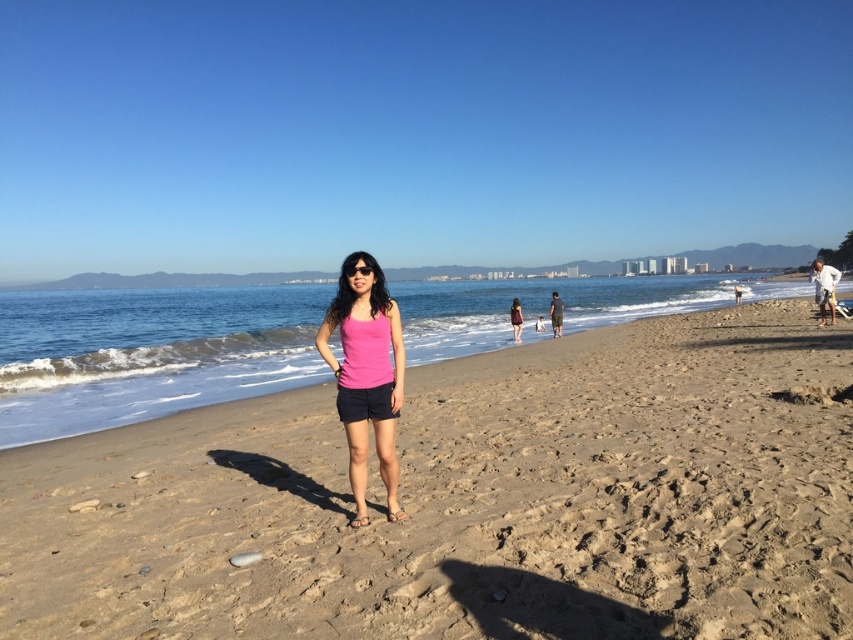
Does light brown sandy beach at center appear on the left side of matte pink tank top at center?

Correct, you'll find light brown sandy beach at center to the left of matte pink tank top at center.

The width and height of the screenshot is (853, 640). Find the location of `light brown sandy beach at center`. light brown sandy beach at center is located at coordinates (469, 500).

This screenshot has height=640, width=853. I want to click on light brown sandy beach at center, so click(469, 500).

Between point (321, 342) and point (509, 314), which one is positioned in front?

Point (321, 342)

Is pink fabric tank top at center below matte pink tank top at center?

Yes, pink fabric tank top at center is below matte pink tank top at center.

Where is `pink fabric tank top at center`? The image size is (853, 640). pink fabric tank top at center is located at coordinates (366, 372).

Does light brown sandy beach at center appear over pink fabric tank top at center?

Actually, light brown sandy beach at center is below pink fabric tank top at center.

Is light brown sandy beach at center to the left of pink fabric tank top at center from the viewer's perspective?

In fact, light brown sandy beach at center is to the right of pink fabric tank top at center.

Is point (607, 624) behind point (339, 314)?

That is False.

Where is `light brown sandy beach at center`? The height and width of the screenshot is (640, 853). light brown sandy beach at center is located at coordinates (469, 500).